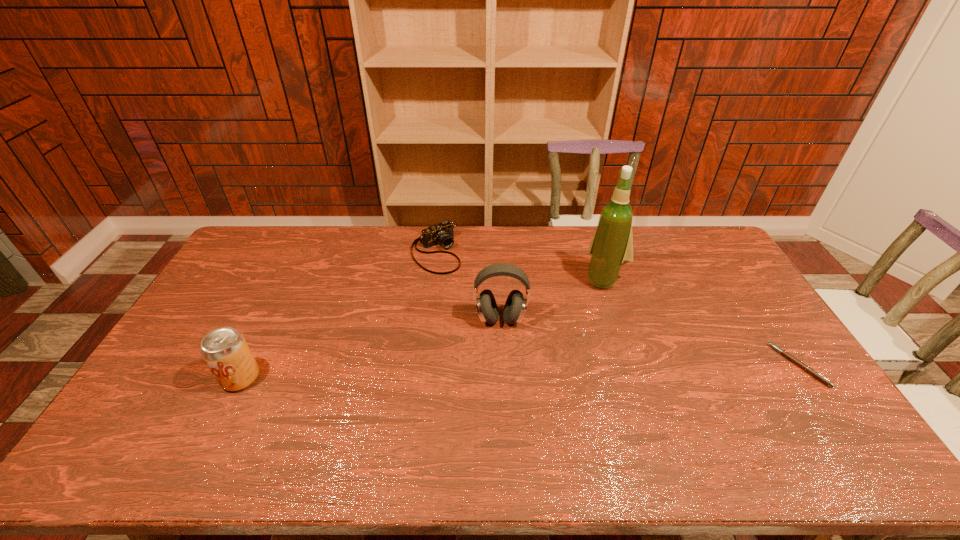
This screenshot has height=540, width=960. Find the location of `vacant space on the desktop that is between the leftmost object and the rightmost object and is positioned on the front-facing side of the tallest object`. vacant space on the desktop that is between the leftmost object and the rightmost object and is positioned on the front-facing side of the tallest object is located at coordinates (539, 371).

The image size is (960, 540). Find the location of `vacant space on the desktop that is between the third tallest object and the rightmost object and is positioned on the front-facing side of the camera`. vacant space on the desktop that is between the third tallest object and the rightmost object and is positioned on the front-facing side of the camera is located at coordinates (539, 371).

This screenshot has width=960, height=540. Find the location of `free space on the desktop that is between the third tallest object and the shortest object and is positioned on the ear cups of the fourth shortest object`. free space on the desktop that is between the third tallest object and the shortest object and is positioned on the ear cups of the fourth shortest object is located at coordinates pyautogui.click(x=495, y=372).